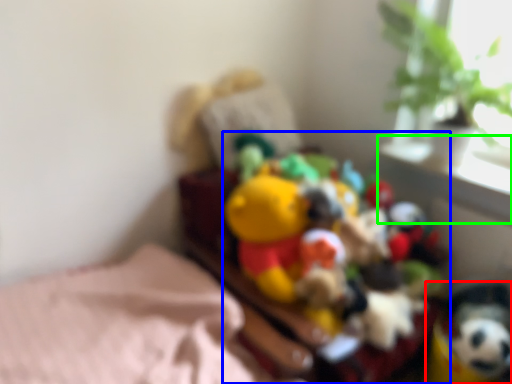
Question: Which is nearer to the toy (highlighted by a red box)? toy (highlighted by a blue box) or window sill (highlighted by a green box).

Choices:
 (A) toy
 (B) window sill

Answer: (A)